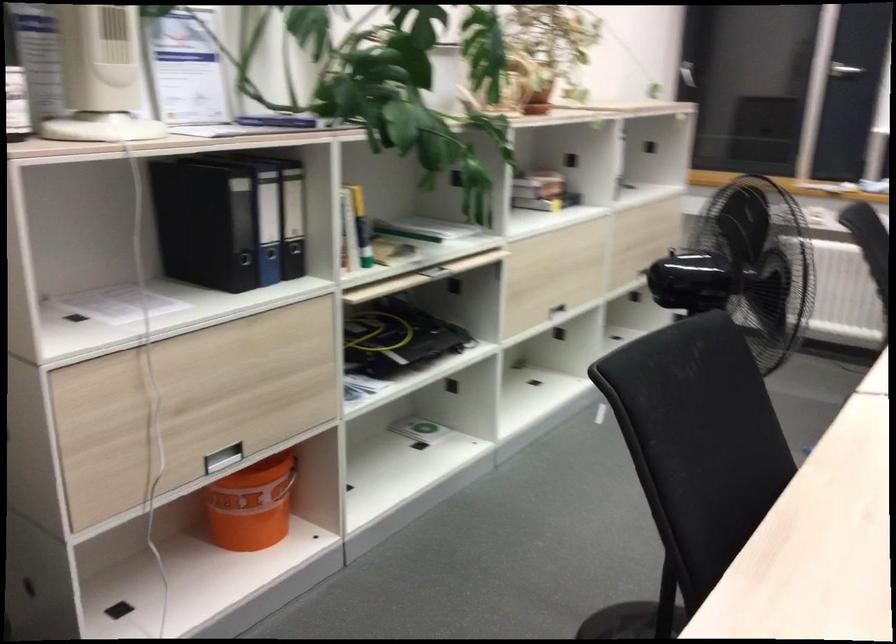
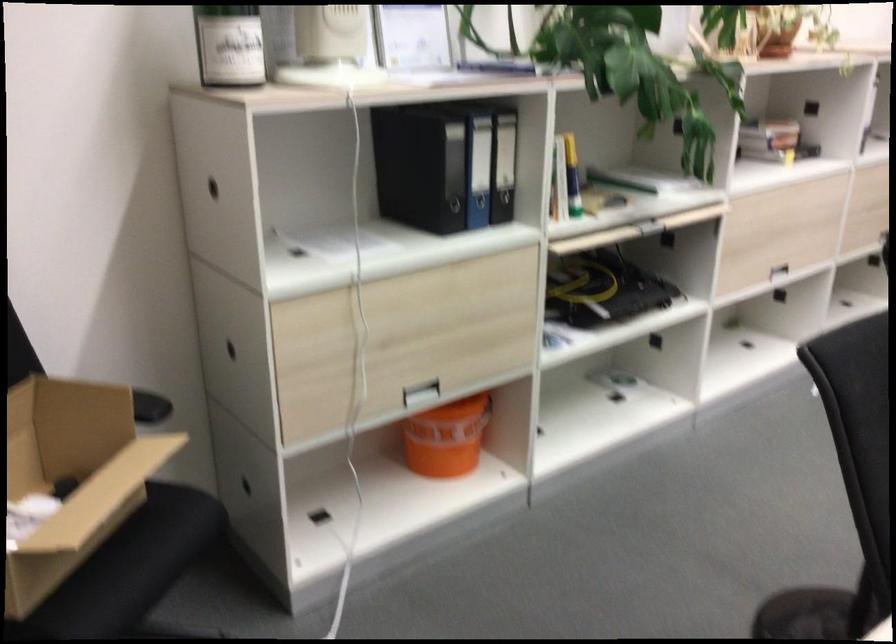
The point at [554,305] is marked in the first image. Where is the corresponding point in the second image?

(771, 266)